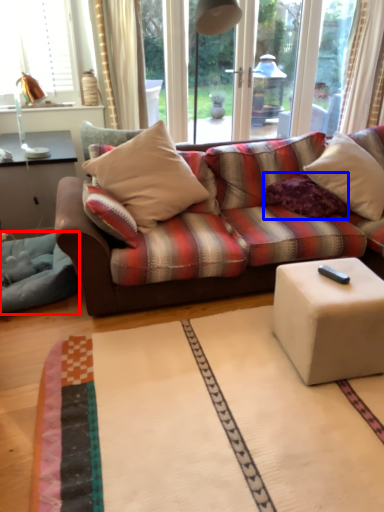
Question: Which of the following is the farthest to the observer, blanket (highlighted by a red box) or pillow (highlighted by a blue box)?

Choices:
 (A) blanket
 (B) pillow

Answer: (B)